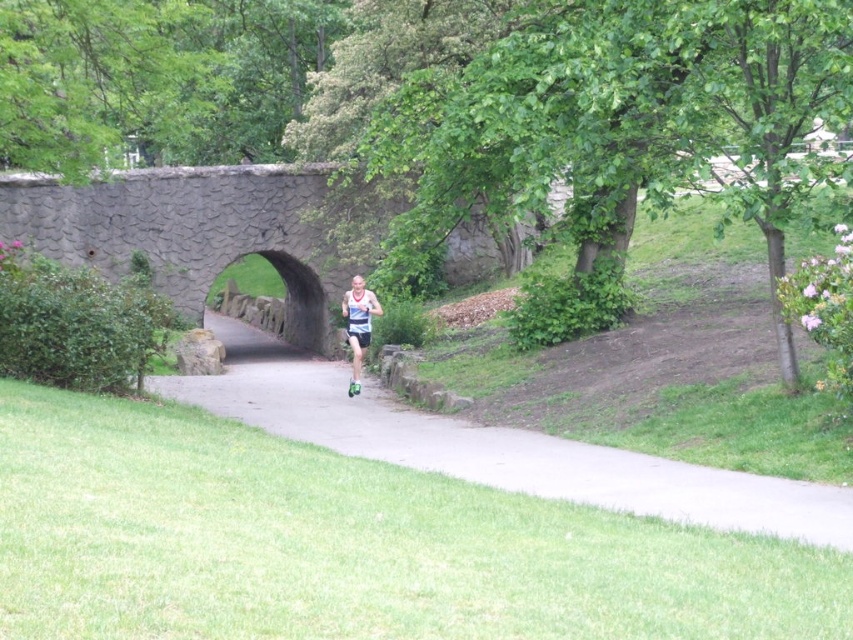
In the scene shown: You are a photographer trying to capture the runner approaching the stone bridge. You notice two points marked in the scene. The first point is at coordinate point(228, 355) and the second is at point(347, 301). Based on their positions, which point is closer to the bridge?

Point(347, 301) is closer to the bridge because it is in front of point(228, 355), which is behind it.

You are a photographer standing at the park entrance. You want to take a photo of the gray asphalt path at center and the matte blue tank top at center so that the path is visible behind the tank top. Is this possible based on their positions?

The gray asphalt path at center is in front of the matte blue tank top at center, so the path cannot be seen behind the tank top in this arrangement.

Looking at this image, you are a photographer aiming to capture the runner in the park. The gray asphalt path at center and the matte blue tank top at center are both in the frame. If you want to ensure the runner remains visible while focusing on the path, which object should you adjust your focus to prioritize?

The gray asphalt path at center is wider than the matte blue tank top at center, so focusing on the path would still allow the runner to remain visible as the path takes up more space in the frame.